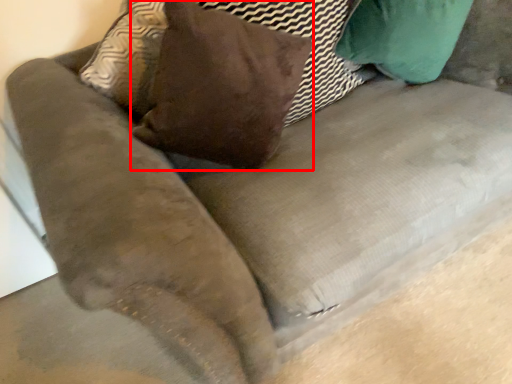
Question: From the image's perspective, what is the correct spatial relationship of throw pillow (annotated by the red box) in relation to pillow?

Choices:
 (A) above
 (B) below

Answer: (A)